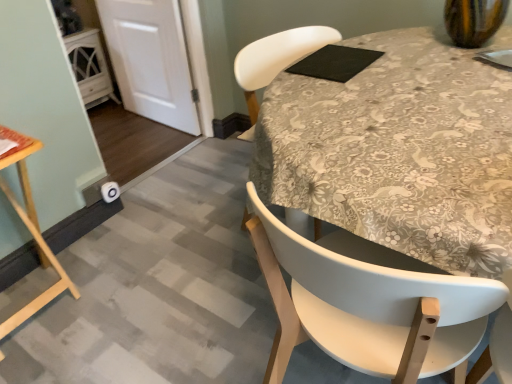
I want to click on vacant space behind black matte pad at upper center, so click(327, 43).